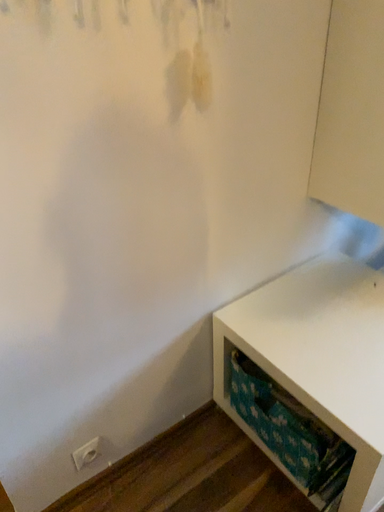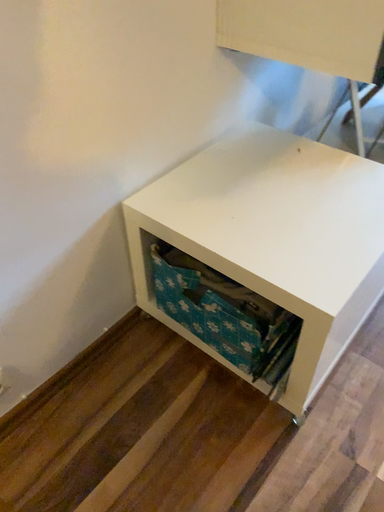
Question: How did the camera likely rotate when shooting the video?

Choices:
 (A) rotated upward
 (B) rotated downward

Answer: (B)